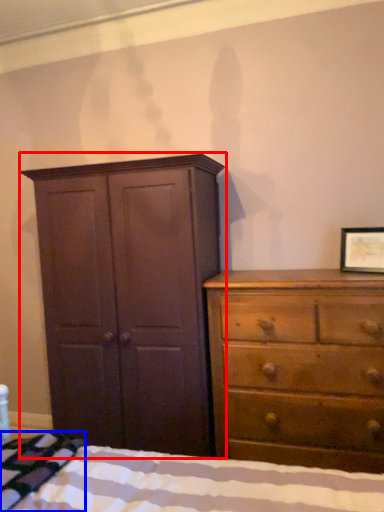
Question: Among these objects, which one is farthest to the camera, cupboard (highlighted by a red box) or blanket (highlighted by a blue box)?

Choices:
 (A) cupboard
 (B) blanket

Answer: (A)